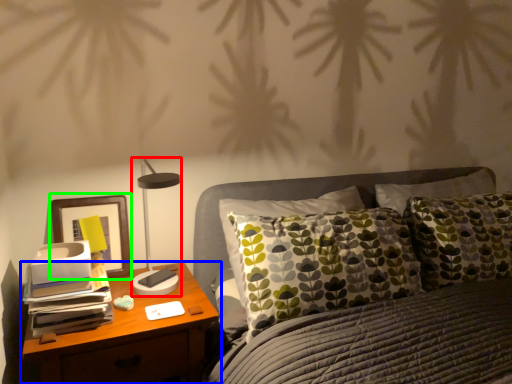
Question: Based on their relative distances, which object is farther from table lamp (highlighted by a red box)? Choose from nightstand (highlighted by a blue box) and picture frame (highlighted by a green box).

Choices:
 (A) nightstand
 (B) picture frame

Answer: (A)